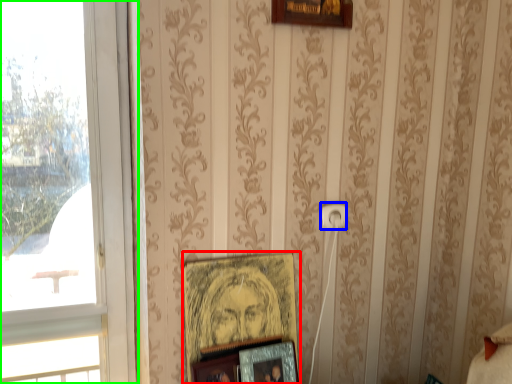
Question: Which object is the closest to the picture frame (highlighted by a red box)? Choose among these: electric outlet (highlighted by a blue box) or window (highlighted by a green box).

Choices:
 (A) electric outlet
 (B) window

Answer: (A)